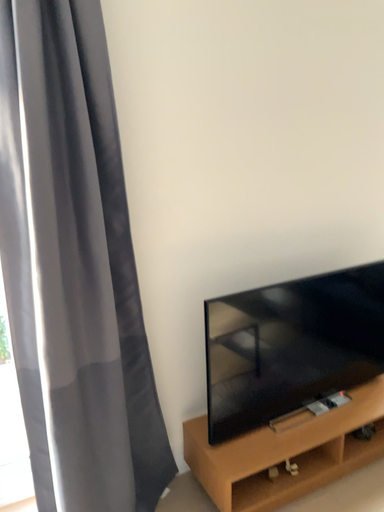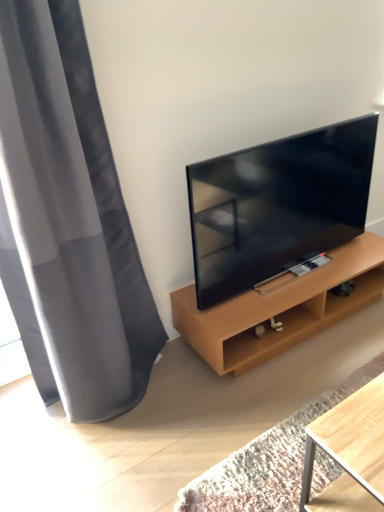
Question: Which way did the camera rotate in the video?

Choices:
 (A) rotated downward
 (B) rotated upward

Answer: (A)